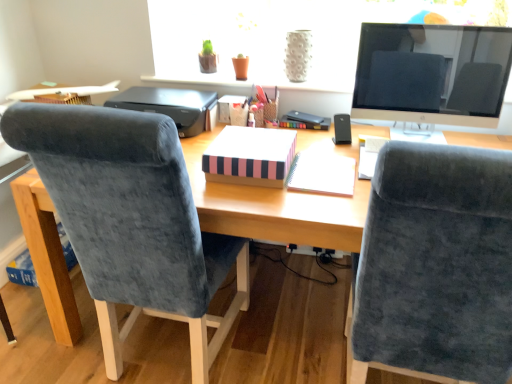
At what (x,y) coordinates should I click in order to perform the action: click on free area below white spiral notebook at center, which ranks as the first notebook in right-to-left order (from a real-world perspective). Please return your answer as a coordinate pair (x, y). Looking at the image, I should click on (338, 175).